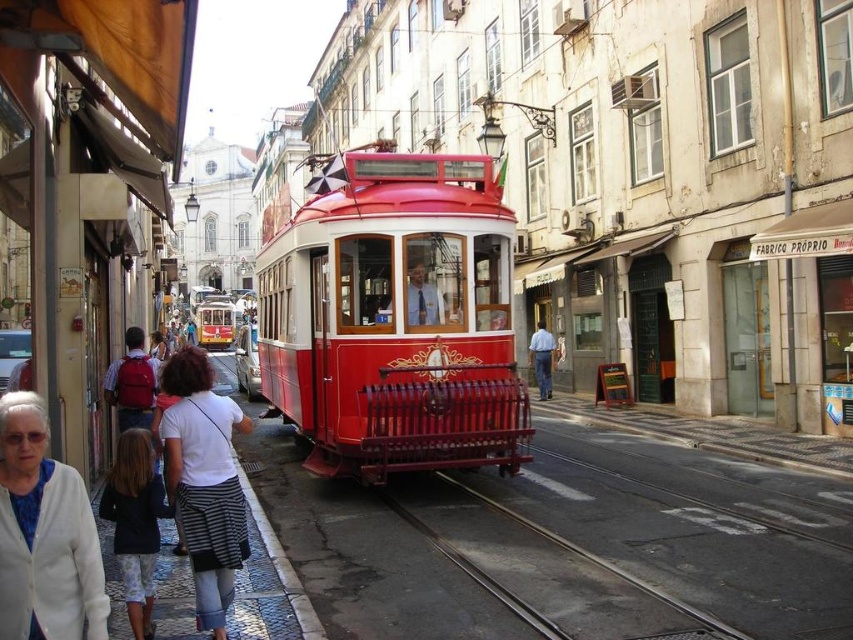
You are a tourist standing on the street in Lisbon and see the iconic red tram. You notice a white fabric jacket at lower left and a metallic gray track at center. Which object is positioned further to the left side of the image?

The white fabric jacket at lower left is positioned further to the left side of the image than the metallic gray track at center.

You are standing on the street in front of the tram and want to reach both points marked on the image. Which point, point (425, 333) or point (592, 556), will you reach first as you move forward?

You will reach point (425, 333) first because it is closer to you than point (592, 556), which is further away.

You are a photographer standing at the camera position capturing this vibrant street scene. You want to focus on the two points in the image labeled as point (708, 618) and point (538, 321). Which point will appear larger in your photo?

Point (708, 618) is closer to the camera than point (538, 321), so it will appear larger in the photo.